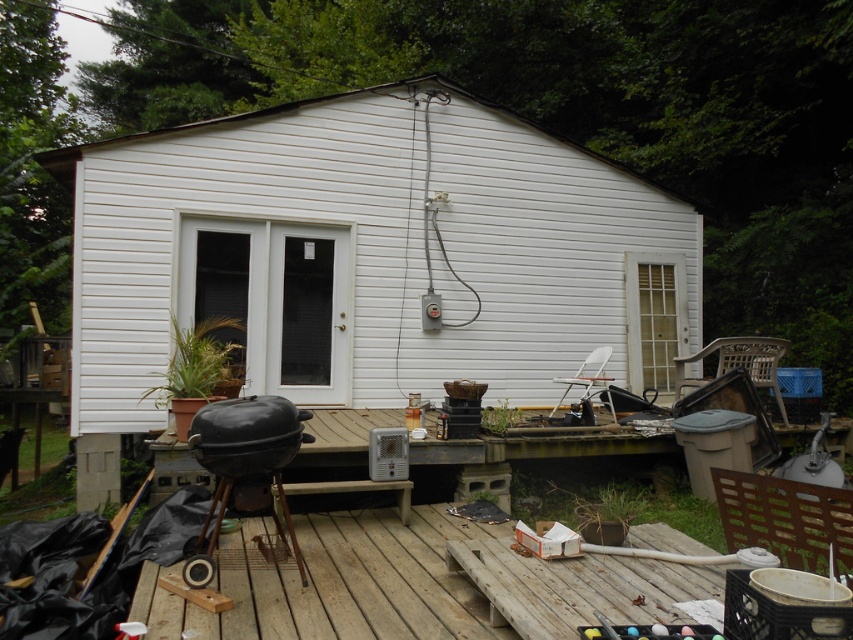
You are standing in front of the shed and want to place a new decorative item. You have two points marked on the deck where you can place it. The first point is at coordinate point (474, 548) and the second is at point (263, 468). Which point is closer to you, the observer?

Point (474, 548) is closer to you because it is further to the viewer than point (263, 468).

You are a painter who needs to paint the white siding shed at center and the wooden bench at lower center. Since you have a ladder, which object will require you to use it more frequently?

The white siding shed at center requires using the ladder more frequently because it has a greater height compared to the wooden bench at lower center.

You are planning to move a 10 feet long ladder from the black matte barbecue grill at lower left to the white siding shed at center. Is there enough space between them to move the ladder without tilting it?

The distance between the white siding shed at center and the black matte barbecue grill at lower left is 12.03 feet, which is greater than the ladder length of 10 feet. Therefore, you can move the ladder horizontally between them without tilting it.